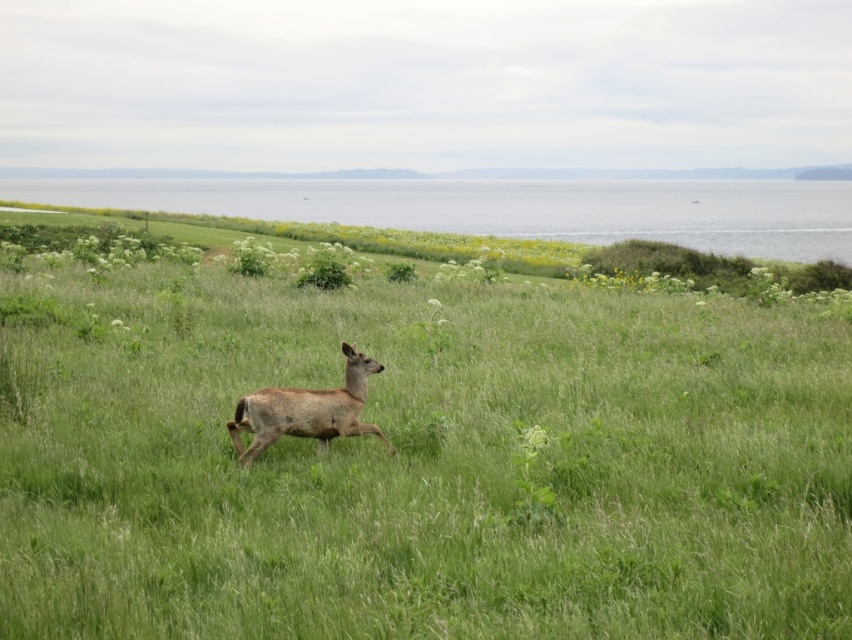
You are a hiker trying to cross the gray water at upper center. The green grassy field at center is a safer path. Which path is wider?

The gray water at upper center is wider than the green grassy field at center, so the gray water at upper center is wider.

You are an animal tracker trying to locate the brown fur deer at center. You notice the gray water at upper center in the distance. Which object is bigger in the image?

The gray water at upper center is larger in size compared to the brown fur deer at center.